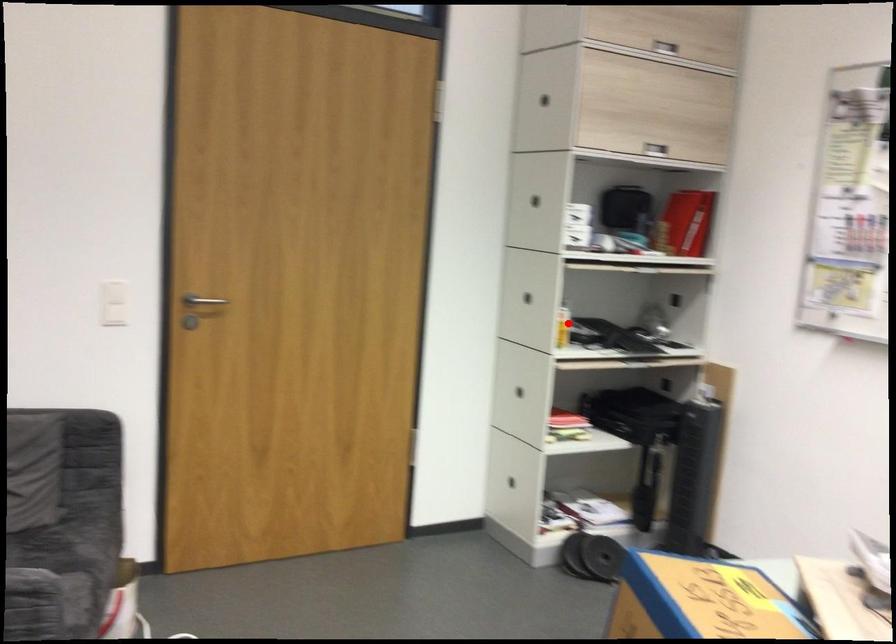
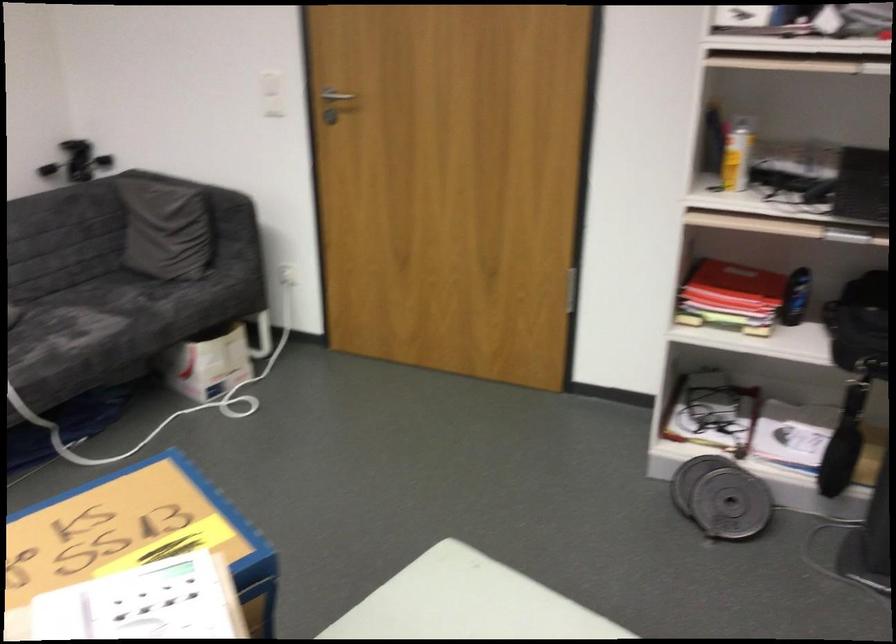
In the second image, find the point that corresponds to the highlighted location in the first image.

(736, 158)